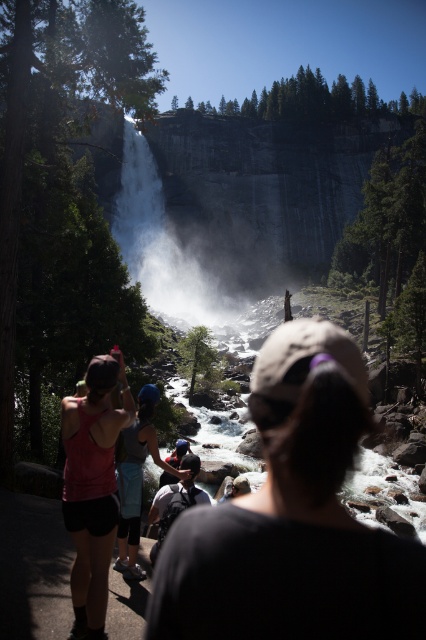
Question: Which of these objects is positioned closest to the matte blue helmet at center?

Choices:
 (A) white textured waterfall at center
 (B) white cotton shirt at center
 (C) pink fabric tank top at left

Answer: (B)

Question: Is matte blue helmet at center smaller than white cotton shirt at center?

Choices:
 (A) no
 (B) yes

Answer: (B)

Question: Which object is positioned farthest from the white textured waterfall at center?

Choices:
 (A) matte blue helmet at center
 (B) black fabric backpack at center
 (C) pink fabric tank top at left
 (D) white cotton shirt at center

Answer: (C)

Question: Does pink fabric tank top at left have a smaller size compared to white cotton shirt at center?

Choices:
 (A) no
 (B) yes

Answer: (B)

Question: Is white textured waterfall at center smaller than matte blue helmet at center?

Choices:
 (A) yes
 (B) no

Answer: (B)

Question: Which object is the closest to the black fabric backpack at center?

Choices:
 (A) pink fabric tank top at left
 (B) white cotton shirt at center
 (C) matte blue helmet at center

Answer: (B)